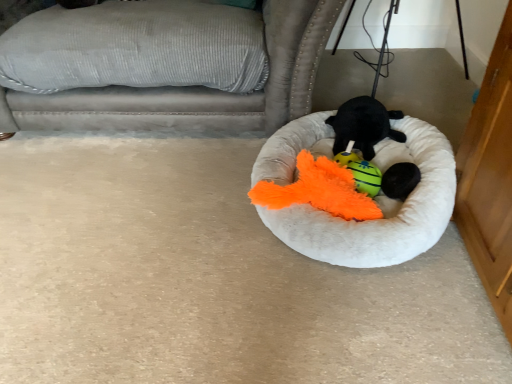
Identify the location of free point in front of white fluffy dog bed at center. (344, 317).